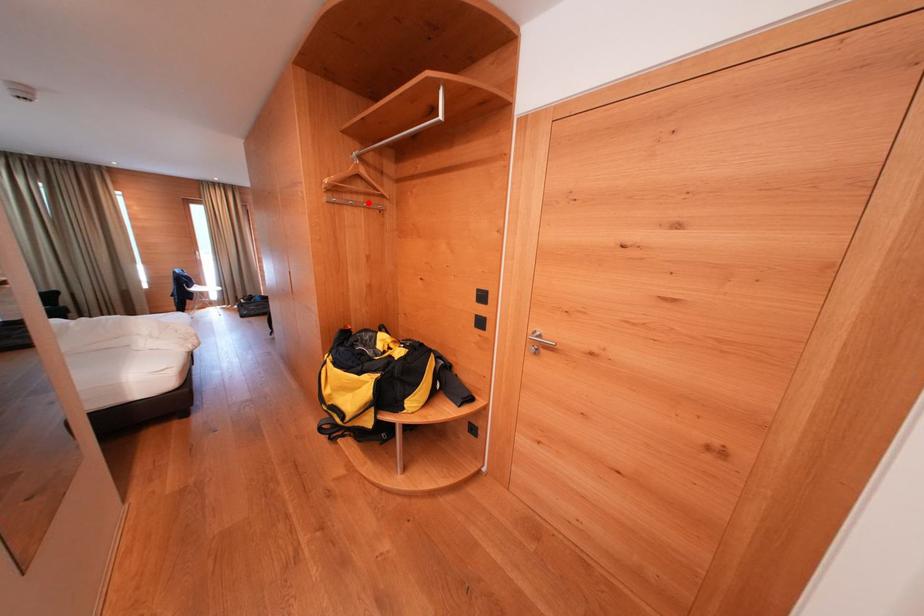
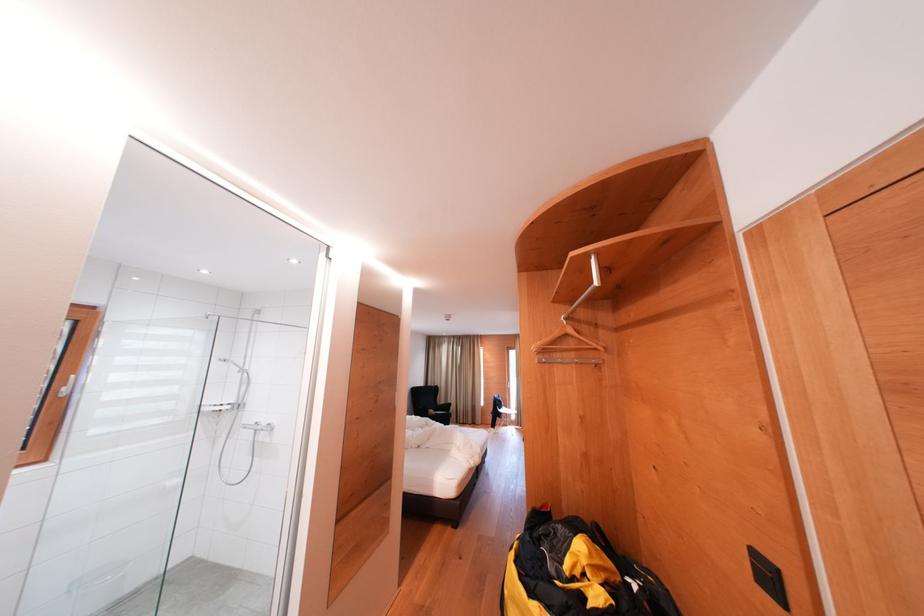
Find the pixel in the second image that matches the highlighted location in the first image.

(579, 359)